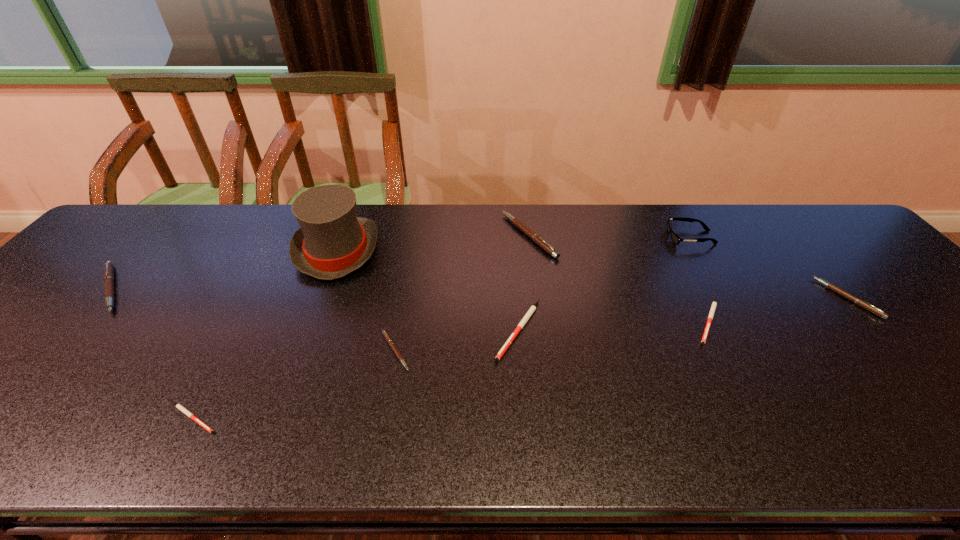
Find the location of `the second white pen from right to left`. the second white pen from right to left is located at coordinates (533, 308).

Locate an element on the screen. the smallest pink pen is located at coordinates (385, 334).

The width and height of the screenshot is (960, 540). What are the coordinates of `the fourth object from left to right` in the screenshot? It's located at (385, 334).

At what (x,y) coordinates should I click in order to perform the action: click on the rightmost white pen. Please return your answer as a coordinate pair (x, y). This screenshot has width=960, height=540. Looking at the image, I should click on (714, 304).

This screenshot has height=540, width=960. I want to click on the second smallest white pen, so click(714, 304).

What are the coordinates of `the nearest object` in the screenshot? It's located at (181, 408).

This screenshot has height=540, width=960. In order to click on the nearest white pen in this screenshot , I will do `click(181, 408)`.

Locate an element on the screen. free region located on the right of the dress hat is located at coordinates (484, 250).

At what (x,y) coordinates should I click in order to perform the action: click on free spot located 0.080m on the front-facing side of the sunglasses. Please return your answer as a coordinate pair (x, y). This screenshot has height=540, width=960. Looking at the image, I should click on (641, 238).

Identify the location of vacant space located 0.190m on the front-facing side of the sunglasses. The width and height of the screenshot is (960, 540). (604, 238).